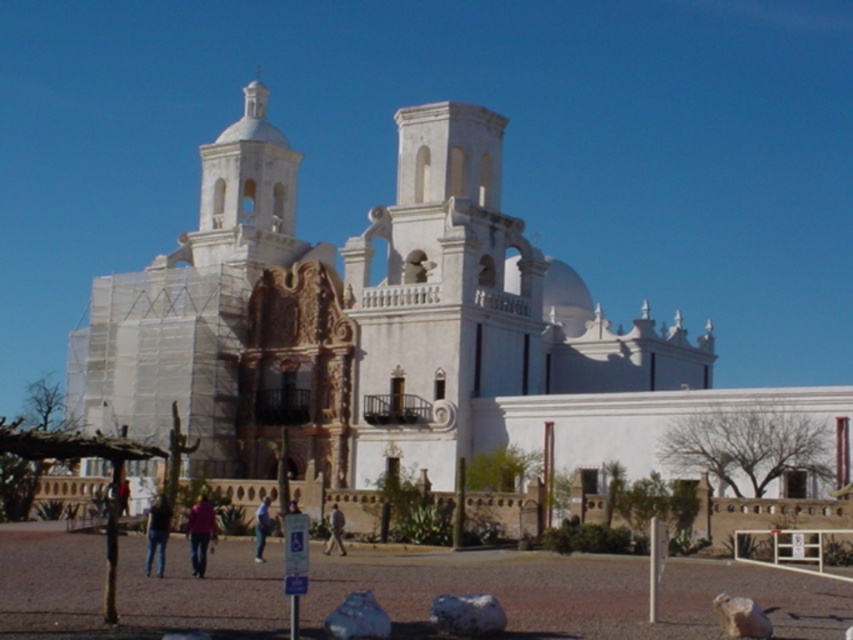
Does smooth beige rock at lower right have a smaller size compared to light brown leather jacket at center?

Correct, smooth beige rock at lower right occupies less space than light brown leather jacket at center.

Can you confirm if smooth beige rock at lower right is taller than light brown leather jacket at center?

No.

Which is behind, point (740, 634) or point (335, 536)?

The point (335, 536) is more distant.

The image size is (853, 640). Find the location of `smooth beige rock at lower right`. smooth beige rock at lower right is located at coordinates (741, 616).

Does point (459, 627) come farther from viewer compared to point (263, 513)?

No, (459, 627) is in front of (263, 513).

This screenshot has width=853, height=640. I want to click on white matte stone at lower center, so click(467, 614).

Between point (724, 593) and point (257, 552), which one is positioned in front?

Positioned in front is point (724, 593).

From the picture: Is smooth beige rock at lower right smaller than blue jeans at lower center?

Yes, smooth beige rock at lower right is smaller than blue jeans at lower center.

Which is in front, point (737, 620) or point (258, 508)?

Point (737, 620)

Locate an element on the screen. The height and width of the screenshot is (640, 853). smooth beige rock at lower right is located at coordinates (741, 616).